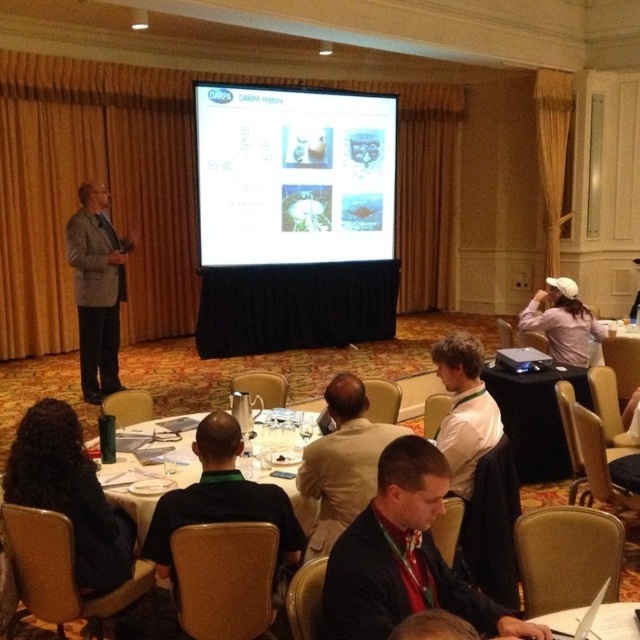
Does black shirt at center have a greater height compared to dark brown suit at center?

No, black shirt at center is not taller than dark brown suit at center.

Does black shirt at center have a larger size compared to dark brown suit at center?

Correct, black shirt at center is larger in size than dark brown suit at center.

Identify the location of black shirt at center. The height and width of the screenshot is (640, 640). (221, 499).

How much distance is there between dark suit at center and dark brown suit at center?

They are 31.93 inches apart.

Which is more to the left, dark suit at center or dark brown suit at center?

From the viewer's perspective, dark brown suit at center appears more on the left side.

Is point (426, 520) positioned before point (378, 444)?

Yes, point (426, 520) is in front of point (378, 444).

Where is `dark suit at center`? dark suit at center is located at coordinates (403, 557).

Which is in front, point (346, 522) or point (579, 333)?

Point (346, 522) is more forward.

The height and width of the screenshot is (640, 640). In order to click on dark brown suit at center in this screenshot , I will do `click(342, 461)`.